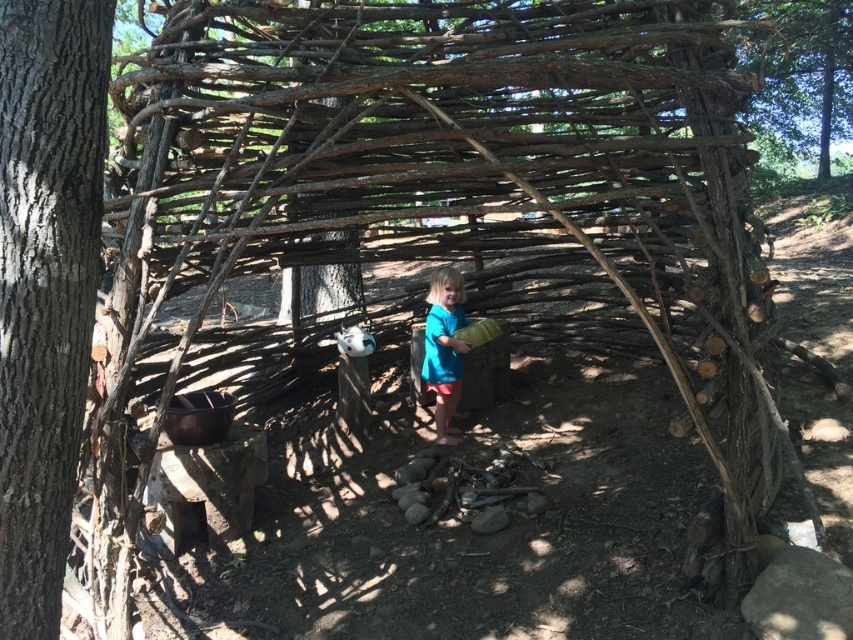
Which of these two, brown rough bark tree at left or green leafy tree at upper right, stands shorter?

With less height is brown rough bark tree at left.

Describe the element at coordinates (45, 285) in the screenshot. I see `brown rough bark tree at left` at that location.

The height and width of the screenshot is (640, 853). In order to click on brown rough bark tree at left in this screenshot , I will do `click(45, 285)`.

Who is more forward, (68, 145) or (457, 371)?

Positioned in front is point (68, 145).

Who is lower down, brown rough bark tree at left or blue fabric at center?

blue fabric at center

Who is more forward, (x=12, y=625) or (x=444, y=442)?

Point (x=12, y=625) is in front.

The height and width of the screenshot is (640, 853). I want to click on brown rough bark tree at left, so pos(45,285).

In the scene shown: Does green leafy tree at upper right appear on the left side of blue fabric at center?

In fact, green leafy tree at upper right is to the right of blue fabric at center.

Which of these two, green leafy tree at upper right or blue fabric at center, stands shorter?

Standing shorter between the two is blue fabric at center.

Where is `green leafy tree at upper right`? The height and width of the screenshot is (640, 853). green leafy tree at upper right is located at coordinates (799, 77).

The height and width of the screenshot is (640, 853). In order to click on green leafy tree at upper right in this screenshot , I will do `click(799, 77)`.